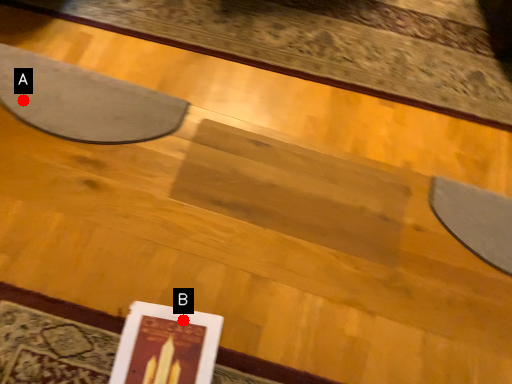
Question: Two points are circled on the image, labeled by A and B beside each circle. Which of the following is the farthest from the observer?

Choices:
 (A) A is further
 (B) B is further

Answer: (A)